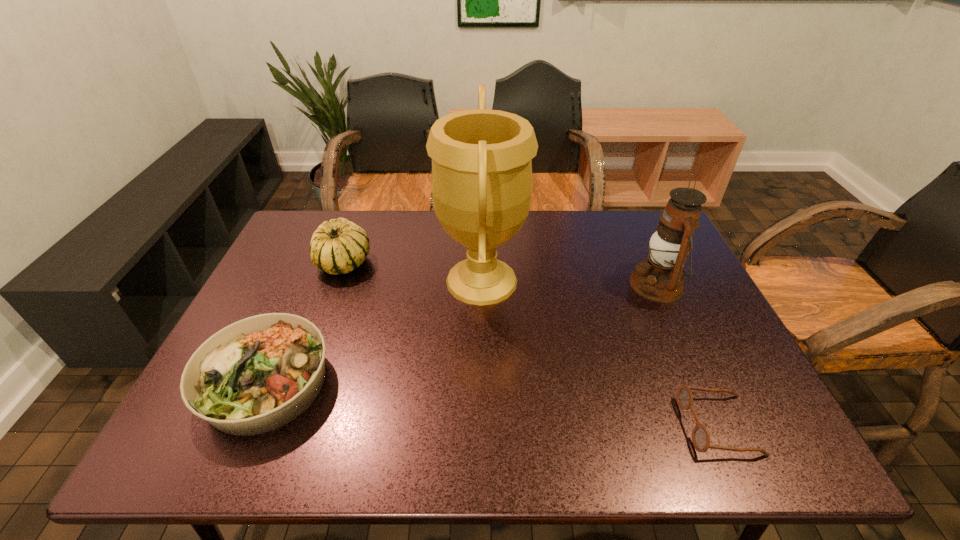
Where is `vacant area at the left edge of the desktop`? vacant area at the left edge of the desktop is located at coordinates (277, 259).

Find the location of a particular element. This screenshot has width=960, height=540. vacant area at the right edge of the desktop is located at coordinates (683, 310).

In order to click on vacant position at the far left corner of the desktop in this screenshot , I will do `click(283, 244)`.

Image resolution: width=960 pixels, height=540 pixels. Identify the location of vacant area at the near right corner of the desktop. (779, 439).

Where is `vacant space that's between the third object from right to left and the third tallest object`? This screenshot has height=540, width=960. vacant space that's between the third object from right to left and the third tallest object is located at coordinates (413, 272).

You are a GUI agent. You are given a task and a screenshot of the screen. Output one action in this format:
    pyautogui.click(x=<x>, y=<y>)
    Task: Click on the free space between the fourth tallest object and the shortest object
    
    Given the screenshot: What is the action you would take?
    pyautogui.click(x=492, y=404)

You are a GUI agent. You are given a task and a screenshot of the screen. Output one action in this format:
    pyautogui.click(x=<x>, y=<y>)
    Task: Click on the vacant area that lies between the spectacles and the salad plate
    
    Given the screenshot: What is the action you would take?
    pyautogui.click(x=492, y=404)

At what (x,y) coordinates should I click in order to perform the action: click on vacant region between the spectacles and the fourth shortest object. Please return your answer as a coordinate pair (x, y). Image resolution: width=960 pixels, height=540 pixels. Looking at the image, I should click on (687, 355).

The width and height of the screenshot is (960, 540). Identify the location of free space between the lantern and the salad plate. (462, 334).

At what (x,y) coordinates should I click in order to perform the action: click on vacant space in between the trophy and the fourth tallest object. Please return your answer as a coordinate pair (x, y). This screenshot has height=540, width=960. Looking at the image, I should click on (374, 332).